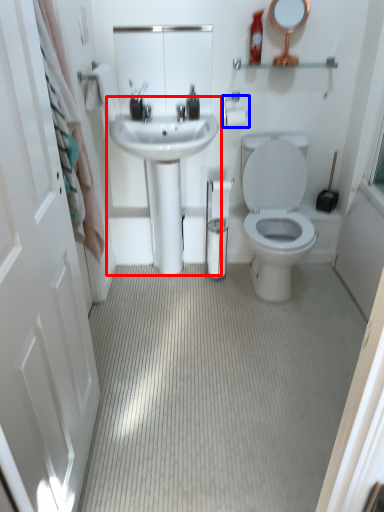
Question: Which object appears farthest to the camera in this image, sink (highlighted by a red box) or towel bar (highlighted by a blue box)?

Choices:
 (A) sink
 (B) towel bar

Answer: (B)